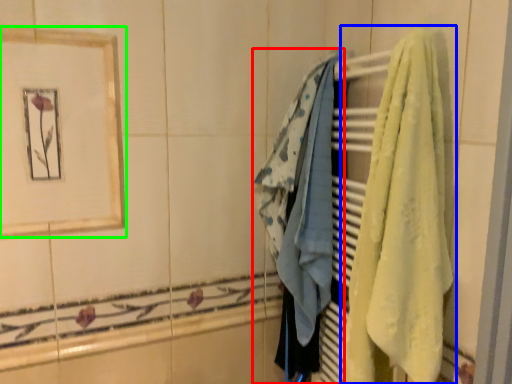
Question: Which is farther away from towel (highlighted by a red box)? towel (highlighted by a blue box) or picture frame (highlighted by a green box)?

Choices:
 (A) towel
 (B) picture frame

Answer: (B)